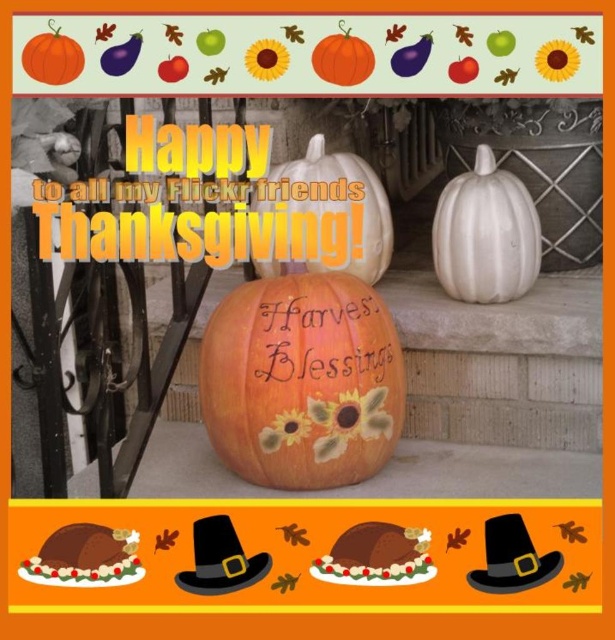
Is orange matte pumpkin at center positioned in front of white matte pumpkin at center?

No, orange matte pumpkin at center is behind white matte pumpkin at center.

Describe the element at coordinates (301, 381) in the screenshot. I see `orange matte pumpkin at center` at that location.

Is point (216, 339) behind point (327, 172)?

No, (216, 339) is closer to viewer.

Locate an element on the screen. This screenshot has width=615, height=640. orange matte pumpkin at center is located at coordinates (301, 381).

Is orange matte pumpkin at center below matte orange pumpkin at upper left?

Yes.

The width and height of the screenshot is (615, 640). What are the coordinates of `orange matte pumpkin at center` in the screenshot? It's located at (301, 381).

Between white matte pumpkin at center and matte orange pumpkin at center, which one has more height?

Standing taller between the two is white matte pumpkin at center.

Does white matte pumpkin at center have a lesser height compared to matte orange pumpkin at center?

No.

Does point (285, 198) come closer to viewer compared to point (351, 84)?

No, (285, 198) is further to viewer.

This screenshot has height=640, width=615. I want to click on white matte pumpkin at center, so click(331, 209).